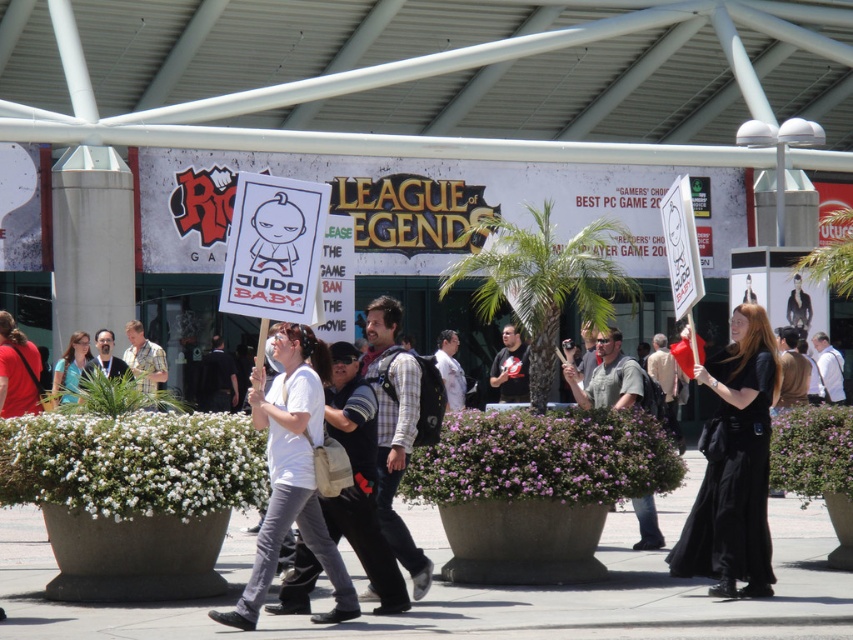
Can you confirm if dark gray backpack at center is thinner than white cotton shirt at center?

In fact, dark gray backpack at center might be wider than white cotton shirt at center.

Locate an element on the screen. The image size is (853, 640). dark gray backpack at center is located at coordinates (218, 378).

Find the location of a particular element. This screenshot has width=853, height=640. dark gray backpack at center is located at coordinates (218, 378).

Between gray concrete pavement at lower center and white fabric shirt at center, which one has less height?

gray concrete pavement at lower center

Looking at this image, who is positioned more to the left, gray concrete pavement at lower center or white fabric shirt at center?

Positioned to the left is gray concrete pavement at lower center.

Who is more forward, [4,595] or [445,349]?

Point [4,595]

Where is `gray concrete pavement at lower center`? This screenshot has height=640, width=853. gray concrete pavement at lower center is located at coordinates (473, 593).

Between black t-shirt at center and white cotton shirt at center, which one has more height?

Standing taller between the two is black t-shirt at center.

Which is more to the right, black t-shirt at center or white cotton shirt at center?

From the viewer's perspective, white cotton shirt at center appears more on the right side.

Measure the distance between point (512, 358) and camera.

The distance of point (512, 358) from camera is 29.66 meters.

The image size is (853, 640). Find the location of `black t-shirt at center`. black t-shirt at center is located at coordinates (509, 368).